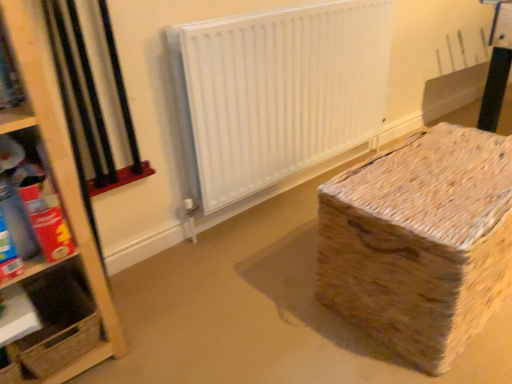
Question: Would you say woven cardboard box at lower right is to the left or to the right of white matte radiator at center in the picture?

Choices:
 (A) right
 (B) left

Answer: (A)

Question: Is woven cardboard box at lower right bigger or smaller than white matte radiator at center?

Choices:
 (A) big
 (B) small

Answer: (A)

Question: Which is nearer to the woven cardboard box at lower right?

Choices:
 (A) cardboard box at left, the 2th shelf from the bottom
 (B) wooden at left, which ranks as the first shelf in bottom-to-top order
 (C) white matte radiator at center

Answer: (C)

Question: Which is farther from the white matte radiator at center?

Choices:
 (A) wooden at left, the second shelf from the top
 (B) cardboard box at left, which is counted as the 1th shelf, starting from the top
 (C) woven cardboard box at lower right

Answer: (B)